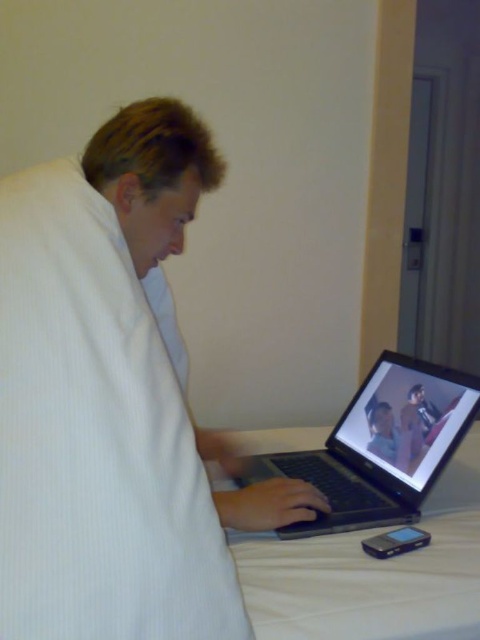
Question: Does white textured robe at center appear on the left side of white fabric bed at lower center?

Choices:
 (A) yes
 (B) no

Answer: (A)

Question: Is white textured robe at center positioned at the back of white fabric bed at lower center?

Choices:
 (A) no
 (B) yes

Answer: (A)

Question: Which object appears farthest from the camera in this image?

Choices:
 (A) black plastic laptop at center
 (B) white fabric bed at lower center
 (C) white textured robe at center

Answer: (A)

Question: Which of the following is the closest to the observer?

Choices:
 (A) (467, 440)
 (B) (146, 276)
 (C) (386, 410)

Answer: (B)

Question: Based on their relative distances, which object is nearer to the white fabric bed at lower center?

Choices:
 (A) white textured robe at center
 (B) black plastic laptop at center

Answer: (B)

Question: Does white textured robe at center come in front of black plastic laptop at center?

Choices:
 (A) no
 (B) yes

Answer: (B)